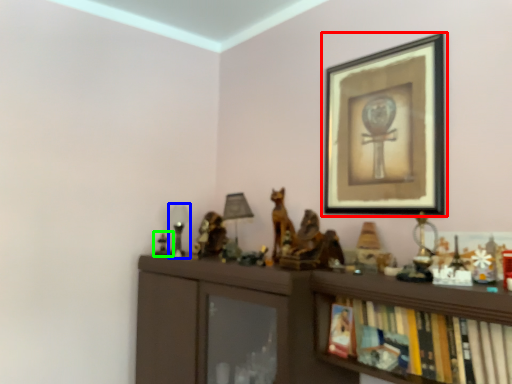
Question: Considering the real-world distances, which object is farthest from picture frame (highlighted by a red box)? table lamp (highlighted by a blue box) or toy (highlighted by a green box)?

Choices:
 (A) table lamp
 (B) toy

Answer: (B)